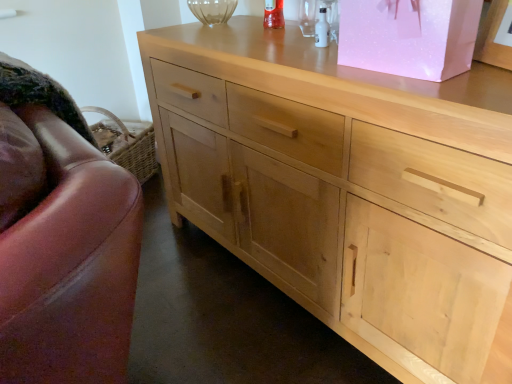
At what (x,y) coordinates should I click in order to perform the action: click on free space in front of pink paper bag at upper right. Please return your answer as a coordinate pair (x, y). The width and height of the screenshot is (512, 384). Looking at the image, I should click on (450, 97).